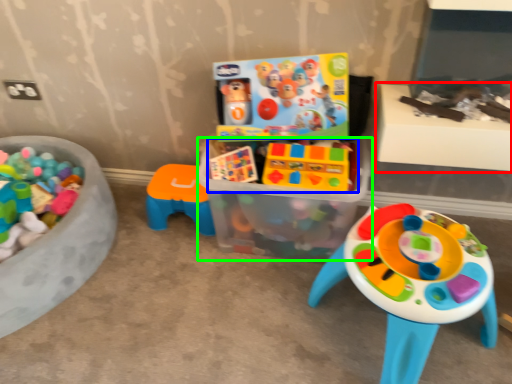
Question: Which is nearer to the table (highlighted by a red box)? toy (highlighted by a blue box) or box (highlighted by a green box).

Choices:
 (A) toy
 (B) box

Answer: (A)